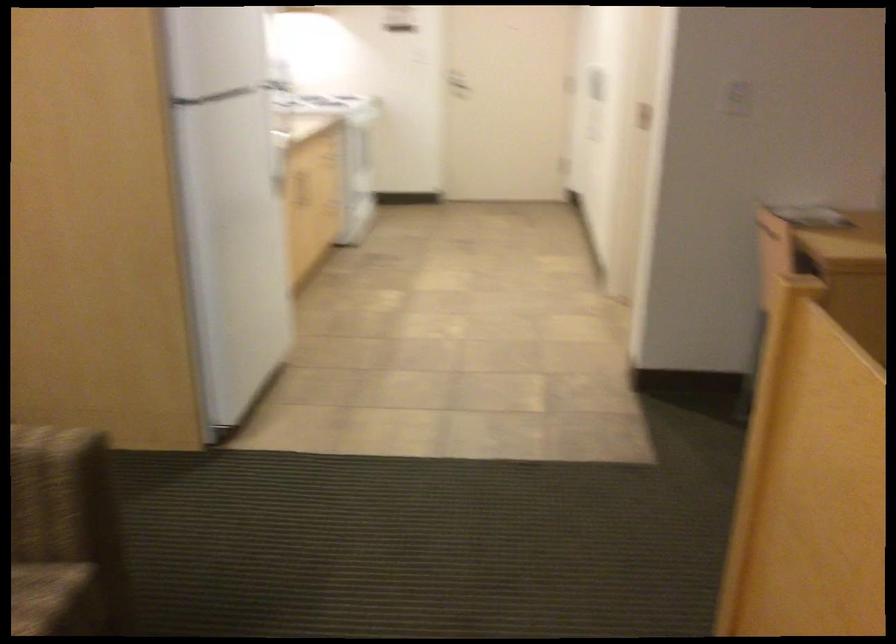
Locate an element on the screen. This screenshot has height=644, width=896. wooden cabinet handle is located at coordinates (297, 187).